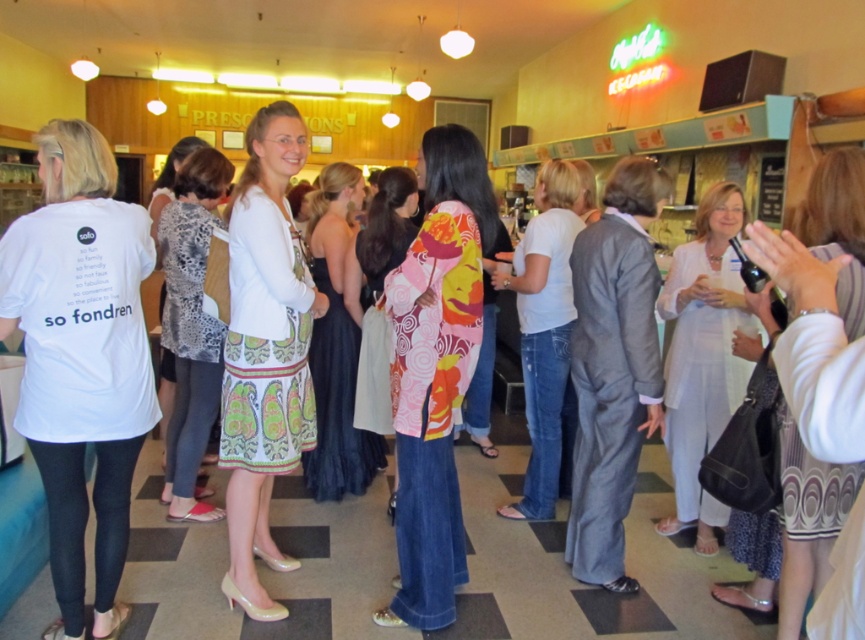
Question: Does floral-patterned fabric at center appear under white printed t-shirt at center?

Choices:
 (A) yes
 (B) no

Answer: (A)

Question: Which of the following is the farthest from the observer?

Choices:
 (A) (825, 234)
 (B) (248, 296)
 (C) (447, 292)
 (D) (377, 182)

Answer: (D)

Question: Which of the following is the closest to the observer?

Choices:
 (A) (100, 298)
 (B) (361, 250)
 (C) (325, 234)
 (D) (639, 195)

Answer: (A)

Question: Is white cotton pants at center in front of white cotton shirt at center?

Choices:
 (A) yes
 (B) no

Answer: (A)

Question: Based on their relative distances, which object is nearer to the white cotton shirt at center?

Choices:
 (A) white printed t-shirt at center
 (B) black satin dress at center

Answer: (B)

Question: Can you confirm if patterned fabric dress at center is positioned to the left of floral-patterned dress at center?

Choices:
 (A) no
 (B) yes

Answer: (A)